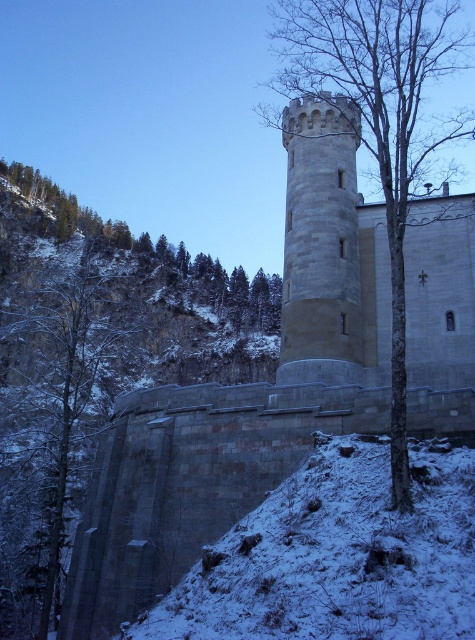
Question: Observing the image, what is the correct spatial positioning of bare wood tree at center in reference to light gray stone tower at center?

Choices:
 (A) above
 (B) below

Answer: (A)

Question: Among these points, which one is nearest to the camera?

Choices:
 (A) (344, 68)
 (B) (104, 259)

Answer: (A)

Question: Which object is positioned farthest from the snowy bark tree at left?

Choices:
 (A) bare wood tree at center
 (B) light gray stone tower at center

Answer: (A)

Question: Is snowy bark tree at left bigger than light gray stone tower at center?

Choices:
 (A) no
 (B) yes

Answer: (B)

Question: Which point is closer to the camera taking this photo?

Choices:
 (A) (340, 342)
 (B) (3, 376)

Answer: (A)

Question: Can you confirm if bare wood tree at center is smaller than light gray stone tower at center?

Choices:
 (A) no
 (B) yes

Answer: (A)